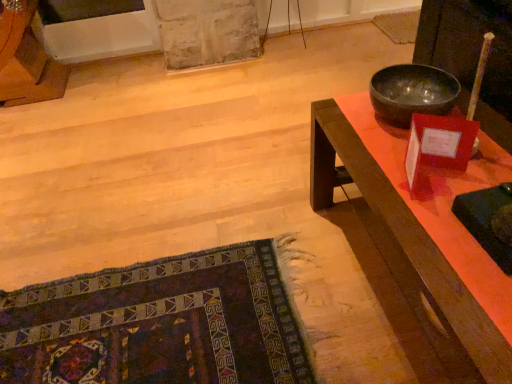
Identify the location of free spot above wooden desk at right (from a real-world perspective). This screenshot has width=512, height=384. (438, 185).